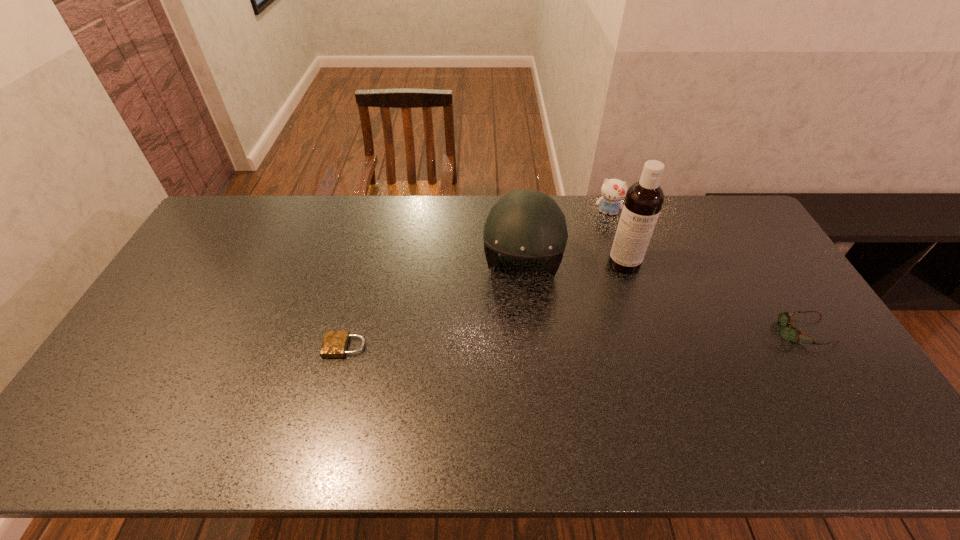
Identify the location of vacant region located on the keyhole side of the shortest object. The height and width of the screenshot is (540, 960). (230, 346).

This screenshot has height=540, width=960. Identify the location of vacant space situated 0.200m on the keyhole side of the shortest object. (252, 346).

The image size is (960, 540). In order to click on free space located on the front-facing side of the third shortest object in this screenshot , I will do `click(596, 272)`.

This screenshot has height=540, width=960. In order to click on vacant region located 0.060m on the front-facing side of the third shortest object in this screenshot , I will do `click(604, 230)`.

At what (x,y) coordinates should I click in order to perform the action: click on vacant space situated on the front-facing side of the third shortest object. Please return your answer as a coordinate pair (x, y). Looking at the image, I should click on (594, 285).

At what (x,y) coordinates should I click in order to perform the action: click on free space located 0.360m on the label side of the tallest object. Please return your answer as a coordinate pair (x, y). Looking at the image, I should click on (644, 372).

The height and width of the screenshot is (540, 960). Identify the location of free region located on the label side of the tallest object. (633, 310).

This screenshot has width=960, height=540. I want to click on free spot located on the label side of the tallest object, so click(632, 305).

Image resolution: width=960 pixels, height=540 pixels. Identify the location of vacant area situated 0.210m at the face opening of the fourth object from right to left. (511, 356).

Find the location of a particular element. This screenshot has height=540, width=960. free space located 0.240m at the face opening of the fourth object from right to left is located at coordinates (510, 366).